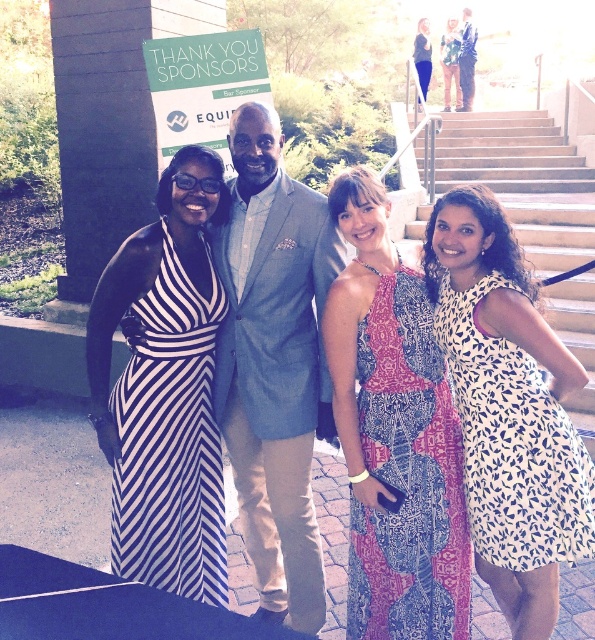
From the picture: You are a photographer trying to adjust the lighting for a group photo. You notice two dresses in the scene, the patterned fabric dress at center and the white printed dress at right. Which dress is taller in the image?

The patterned fabric dress at center is taller than the white printed dress at right according to the description.